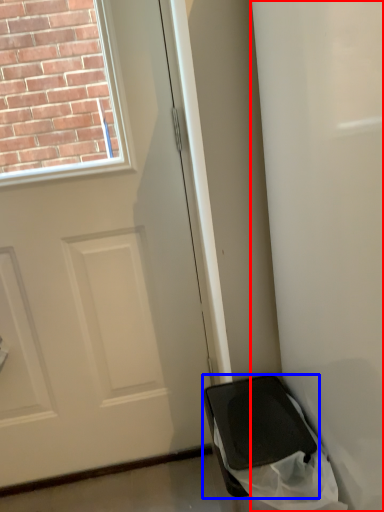
Question: Which object appears farthest to the camera in this image, screen door (highlighted by a red box) or furniture (highlighted by a blue box)?

Choices:
 (A) screen door
 (B) furniture

Answer: (B)